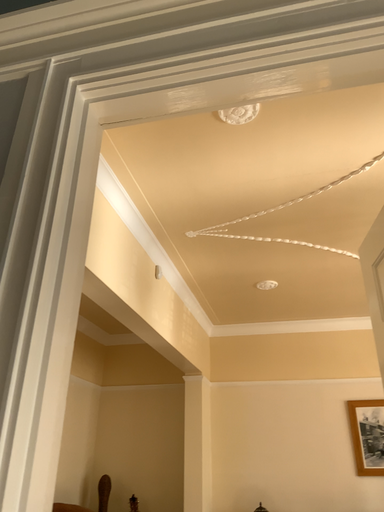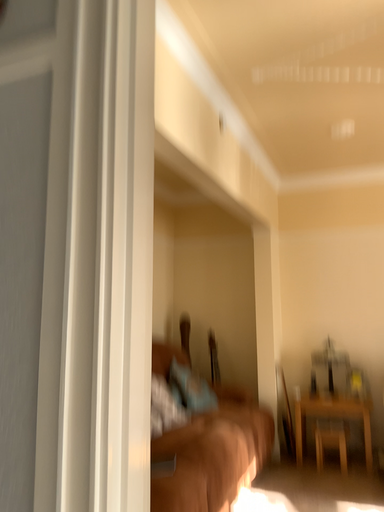
Question: How did the camera likely rotate when shooting the video?

Choices:
 (A) rotated left
 (B) rotated right

Answer: (A)